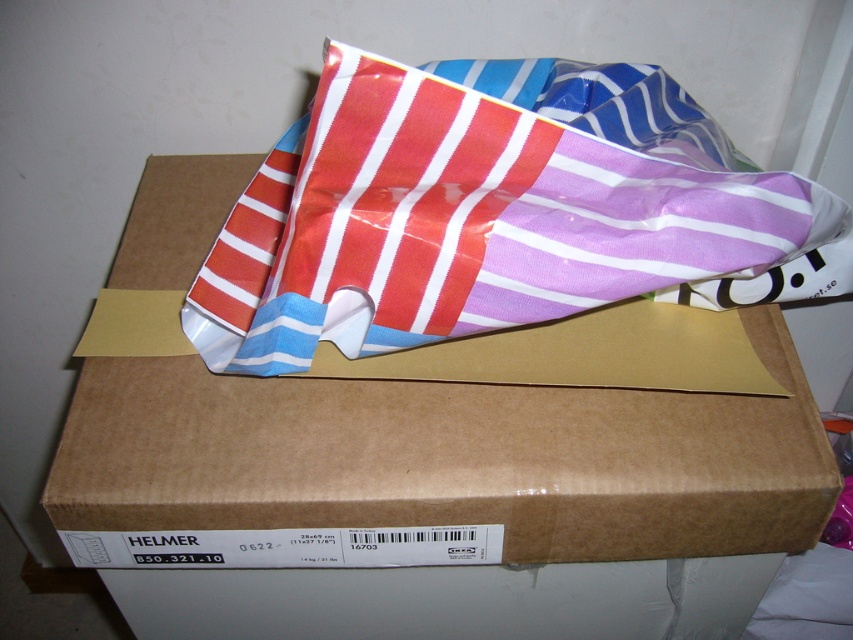
Question: Can you confirm if brown cardboard box at center is positioned to the left of striped plastic bag at center?

Choices:
 (A) no
 (B) yes

Answer: (B)

Question: Observing the image, what is the correct spatial positioning of brown cardboard box at center in reference to striped plastic bag at center?

Choices:
 (A) below
 (B) above

Answer: (A)

Question: Which of the following is the farthest from the observer?

Choices:
 (A) brown cardboard box at center
 (B) striped plastic bag at center

Answer: (A)

Question: Which point is closer to the camera taking this photo?

Choices:
 (A) 695,605
 (B) 297,218

Answer: (B)

Question: Does brown cardboard box at center come behind striped plastic bag at center?

Choices:
 (A) yes
 (B) no

Answer: (A)

Question: Which point appears farthest from the camera in this image?

Choices:
 (A) (744, 269)
 (B) (386, 429)

Answer: (B)